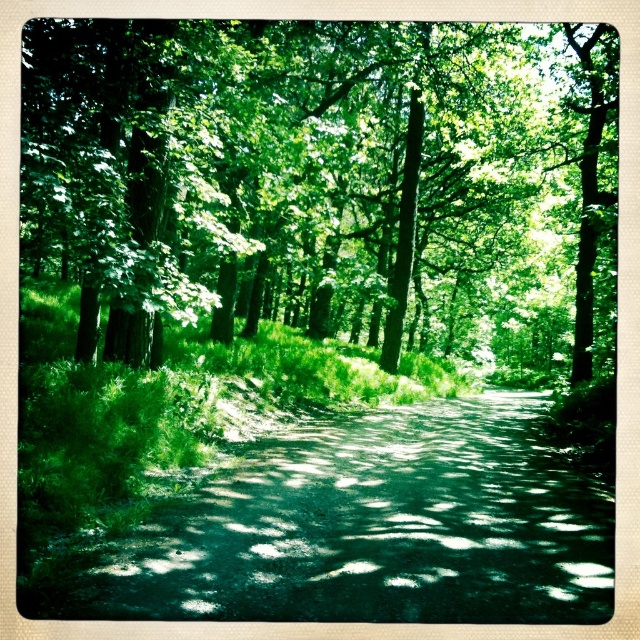
Between green leafy tree at upper center and dark green asphalt at center, which one has less height?

Standing shorter between the two is dark green asphalt at center.

Which is above, green leafy tree at upper center or dark green asphalt at center?

green leafy tree at upper center is above.

Describe the element at coordinates (316, 172) in the screenshot. I see `green leafy tree at upper center` at that location.

You are a GUI agent. You are given a task and a screenshot of the screen. Output one action in this format:
    pyautogui.click(x=<x>, y=<y>)
    Task: Click on the green leafy tree at upper center
    
    Given the screenshot: What is the action you would take?
    pyautogui.click(x=316, y=172)